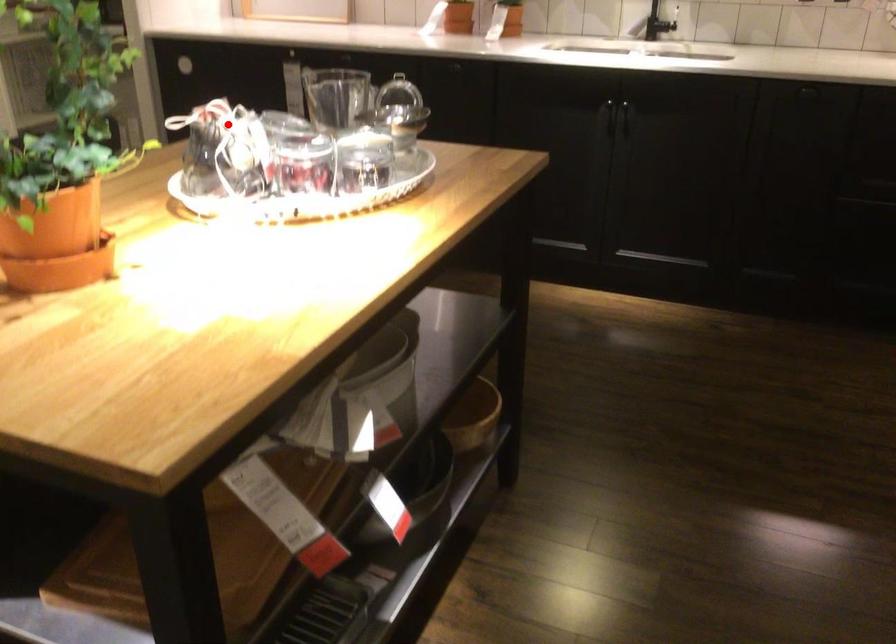
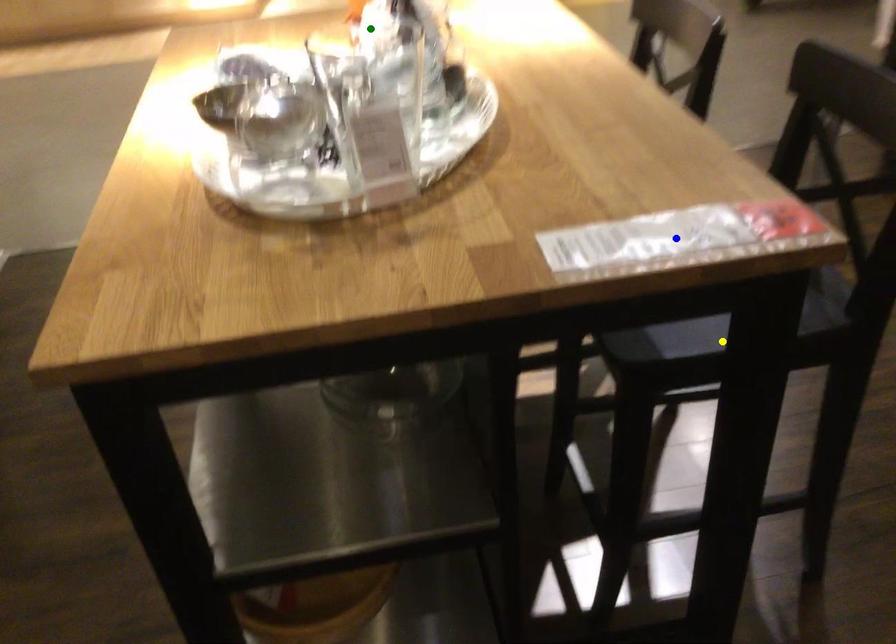
Question: I am providing you with two images of the same scene from different viewpoints. A red point is marked on the first image. You are given multiple points on the second image. Which spot in image 2 lines up with the point in image 1?

Choices:
 (A) yellow point
 (B) green point
 (C) blue point

Answer: (B)